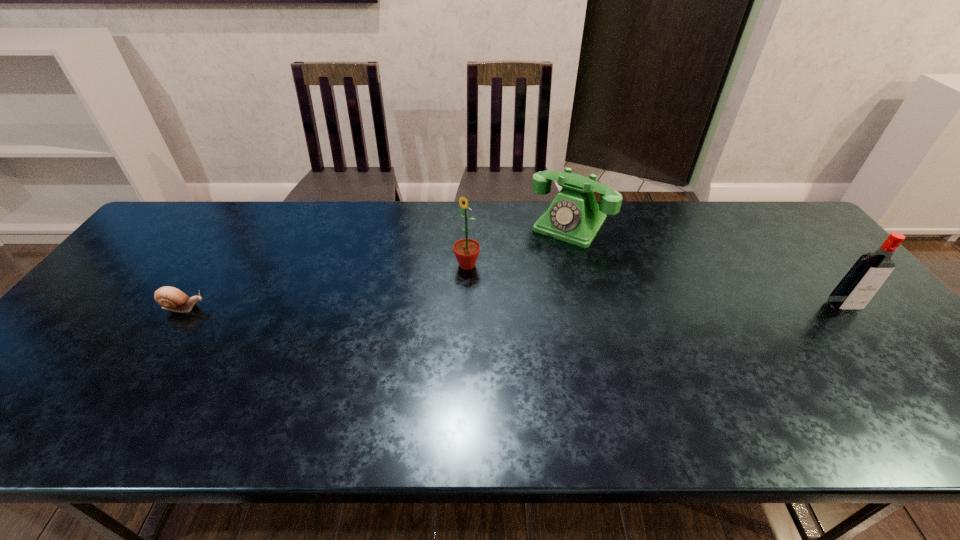
This screenshot has width=960, height=540. In order to click on vacant space located on the dial of the third tallest object in this screenshot , I will do `click(527, 285)`.

You are a GUI agent. You are given a task and a screenshot of the screen. Output one action in this format:
    pyautogui.click(x=<x>, y=<y>)
    Task: Click on the vacant space situated 0.090m on the dial of the third tallest object
    The height and width of the screenshot is (540, 960).
    Given the screenshot: What is the action you would take?
    pyautogui.click(x=542, y=262)

I want to click on vacant space located 0.160m on the face of the sunflower, so click(423, 306).

This screenshot has height=540, width=960. I want to click on blank space located 0.340m on the face of the sunflower, so click(374, 352).

Where is `vacant space located 0.400m on the face of the sunflower`? vacant space located 0.400m on the face of the sunflower is located at coordinates (355, 369).

Locate an element on the screen. The height and width of the screenshot is (540, 960). object that is at the far edge is located at coordinates (574, 216).

The height and width of the screenshot is (540, 960). I want to click on object at the right edge, so click(x=862, y=281).

The width and height of the screenshot is (960, 540). Find the location of `free space at the far edge`. free space at the far edge is located at coordinates (635, 208).

Identify the location of free space at the near edge of the desktop. coord(199,396).

In the image, there is a desktop. Where is `vacant space at the left edge`? The height and width of the screenshot is (540, 960). vacant space at the left edge is located at coordinates (131, 259).